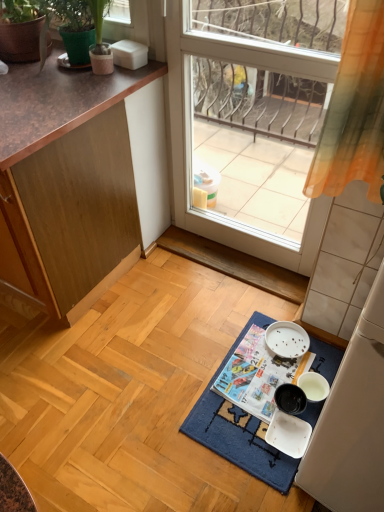
The image size is (384, 512). I want to click on free space to the left of white plastic bowl at lower right, so click(x=241, y=430).